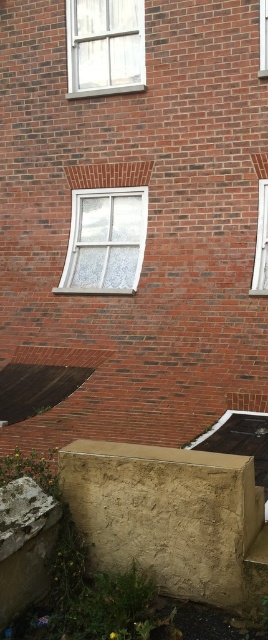
Question: Does white frosted glass window at center appear on the right side of white painted wood window at upper left?

Choices:
 (A) yes
 (B) no

Answer: (A)

Question: Which of the following is the closest to the observer?

Choices:
 (A) clear glass window at upper right
 (B) white glass window at right

Answer: (B)

Question: Can you confirm if white frosted glass window at center is positioned above clear glass window at upper right?

Choices:
 (A) yes
 (B) no

Answer: (B)

Question: Estimate the real-world distances between objects in this image. Which object is closer to the white painted wood window at upper left?

Choices:
 (A) clear glass window at upper right
 (B) white frosted glass window at center
 (C) white glass window at right

Answer: (B)

Question: Considering the relative positions of white frosted glass window at center and white painted wood window at upper left in the image provided, where is white frosted glass window at center located with respect to white painted wood window at upper left?

Choices:
 (A) left
 (B) right

Answer: (B)

Question: Which point is farther to the camera?

Choices:
 (A) (68, 44)
 (B) (266, 232)
 (C) (97, 188)
 (D) (266, 44)

Answer: (A)